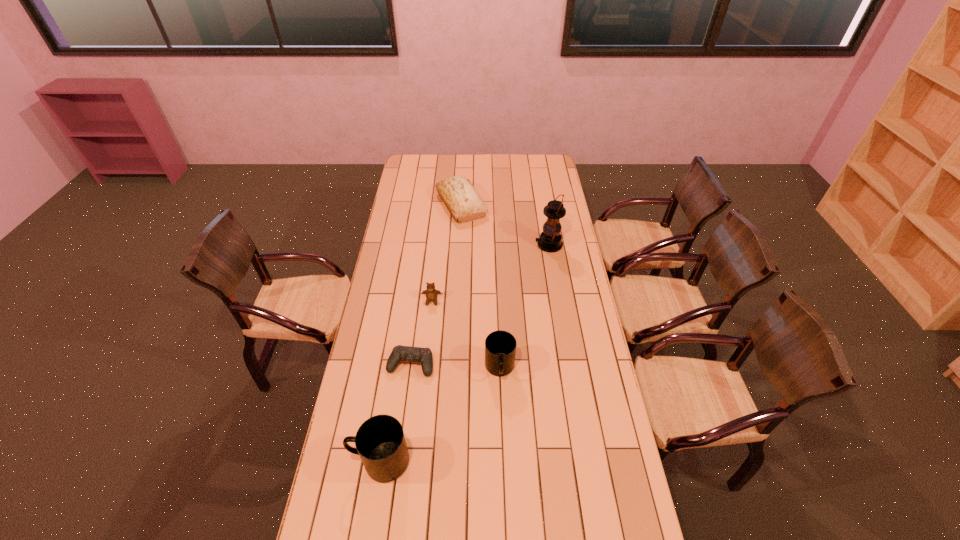
In the current image, all mugs are evenly spaced. To maintain this equal spacing, where should an additional mug be placed on the right? Please point out a free spot. Please provide its 2D coordinates. Your answer should be formatted as a tuple, i.e. [(x, y)], where the tuple contains the x and y coordinates of a point satisfying the conditions above.

[(588, 300)]